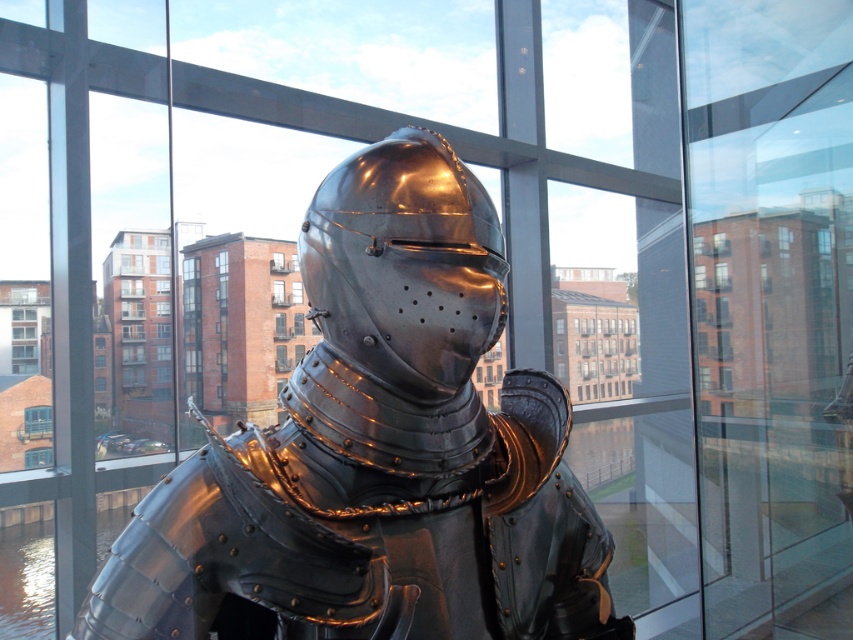
You are an interior designer assessing the placement of the shiny metal armor at center and the shiny metallic helmet at center. Based on their positions, which object is closer to the window that overlooks the urban landscape?

The shiny metallic helmet at center is closer to the window because it is positioned above the shiny metal armor at center, which is located below it.